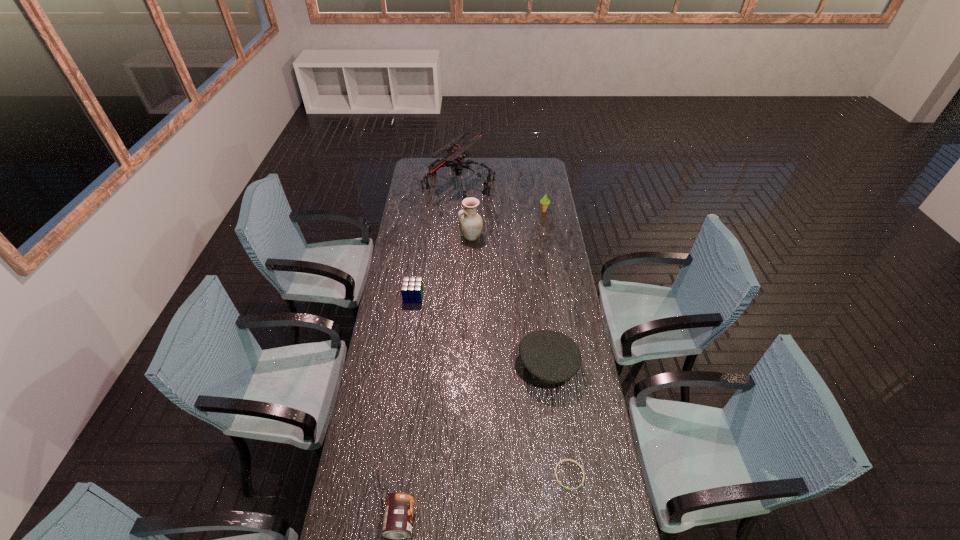
Locate which object is the second closest to the nearest object. Please provide its 2D coordinates. Your answer should be formatted as a tuple, i.e. [(x, y)], where the tuple contains the x and y coordinates of a point satisfying the conditions above.

[(545, 357)]

Identify which object is located as the second nearest to the sixth farthest object. Please provide its 2D coordinates. Your answer should be formatted as a tuple, i.e. [(x, y)], where the tuple contains the x and y coordinates of a point satisfying the conditions above.

[(398, 517)]

At what (x,y) coordinates should I click in order to perform the action: click on free space that satisfies the following two spatial constraints: 1. on the back side of the cube; 2. on the right side of the icecream. Please return your answer as a coordinate pair (x, y). This screenshot has width=960, height=540. Looking at the image, I should click on (426, 211).